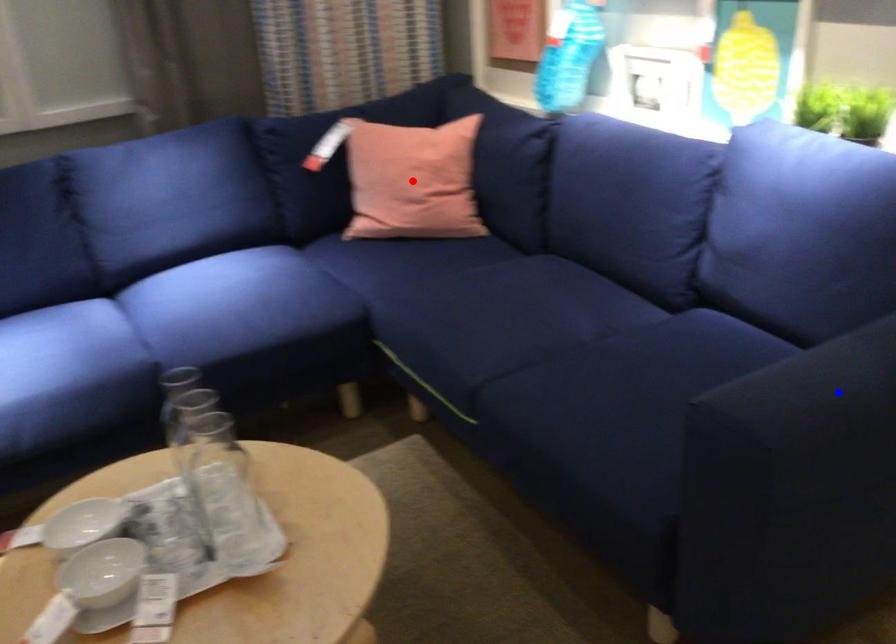
Question: Two points are marked on the image. Which point is closer to the camera?

Choices:
 (A) Blue point is closer.
 (B) Red point is closer.

Answer: (A)